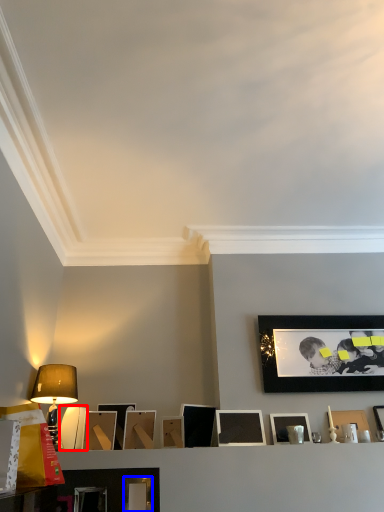
Question: Which of the following is the farthest to the observer, picture frame (highlighted by a red box) or picture frame (highlighted by a blue box)?

Choices:
 (A) picture frame
 (B) picture frame

Answer: (A)